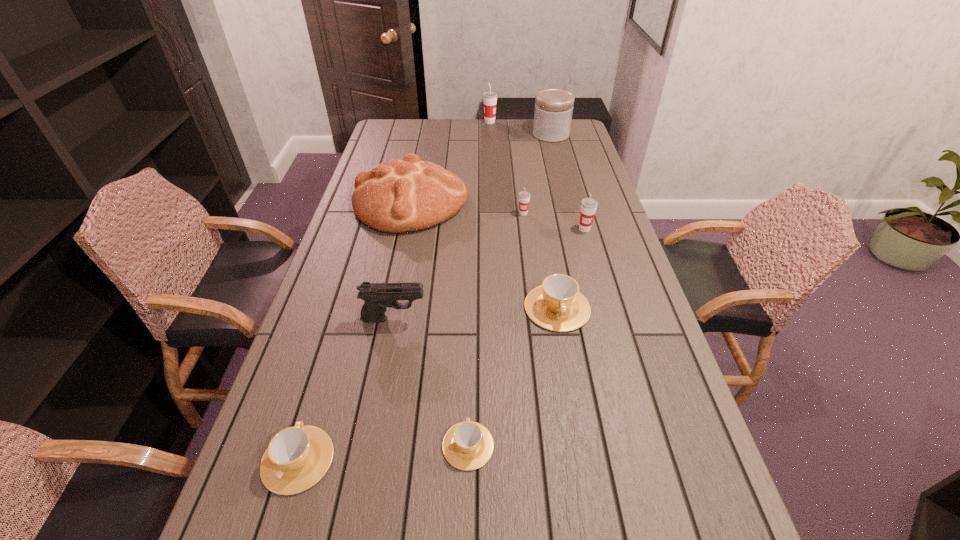
Find the location of a particular element. This screenshot has height=540, width=960. cup object that ranks as the fourth closest to the second red cup from left to right is located at coordinates (468, 445).

In order to click on red cup that is the third closest to the pistol in this screenshot , I will do `click(490, 97)`.

I want to click on the closest red cup to the smallest red cup, so click(x=588, y=205).

Select which brown cup is the third closest to the farthest red cup. Please provide its 2D coordinates. Your answer should be formatted as a tuple, i.e. [(x, y)], where the tuple contains the x and y coordinates of a point satisfying the conditions above.

[(297, 457)]

Select which brown cup appears as the closest to the fifth shortest cup. Please provide its 2D coordinates. Your answer should be formatted as a tuple, i.e. [(x, y)], where the tuple contains the x and y coordinates of a point satisfying the conditions above.

[(557, 305)]